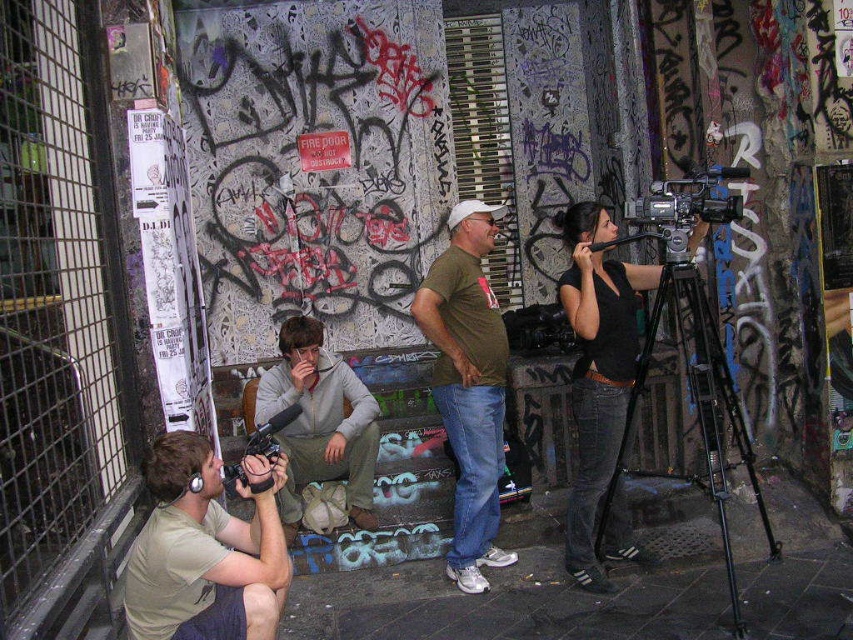
Is black matte camera at right thinner than matte black video camera at lower left?

Yes.

This screenshot has width=853, height=640. Describe the element at coordinates (596, 369) in the screenshot. I see `black matte camera at right` at that location.

Identify the location of black matte camera at right. (596, 369).

Locate an element on the screen. Image resolution: width=853 pixels, height=640 pixels. black matte camera at right is located at coordinates (596, 369).

Consider the image. Is green cotton t-shirt at center further to the viewer compared to black plastic video camera at upper right?

Yes, it is.

Looking at this image, is green cotton t-shirt at center thinner than black plastic video camera at upper right?

Yes, green cotton t-shirt at center is thinner than black plastic video camera at upper right.

Does point (486, 538) come farther from viewer compared to point (720, 204)?

Yes.

Image resolution: width=853 pixels, height=640 pixels. In order to click on green cotton t-shirt at center in this screenshot , I will do `click(468, 385)`.

Which of these two, matte green t-shirt at lower left or matte black video camera at lower left, stands taller?

matte green t-shirt at lower left

Which of these two, matte green t-shirt at lower left or matte black video camera at lower left, stands shorter?

With less height is matte black video camera at lower left.

Which is behind, point (157, 476) or point (227, 477)?

Point (227, 477)

The width and height of the screenshot is (853, 640). Identify the location of matte green t-shirt at lower left. (206, 548).